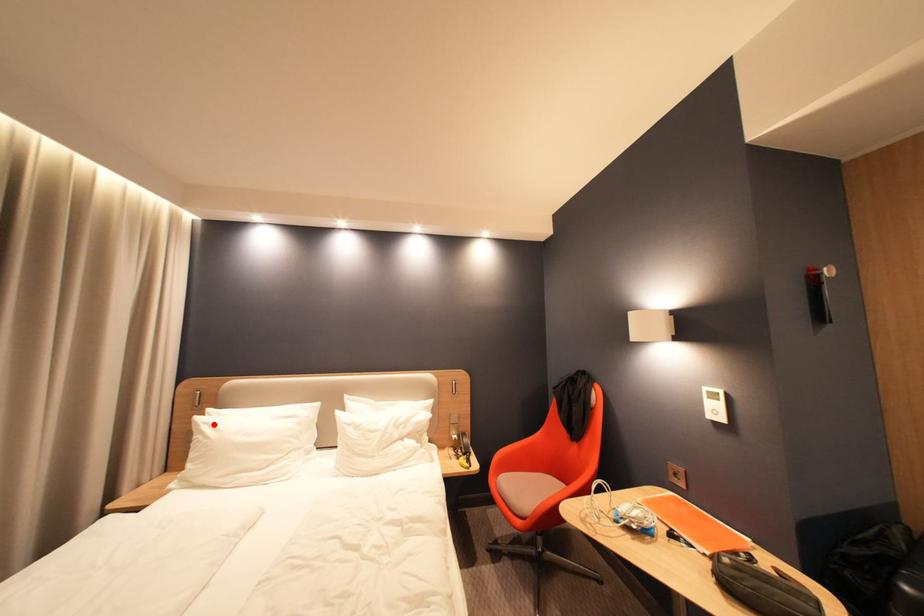
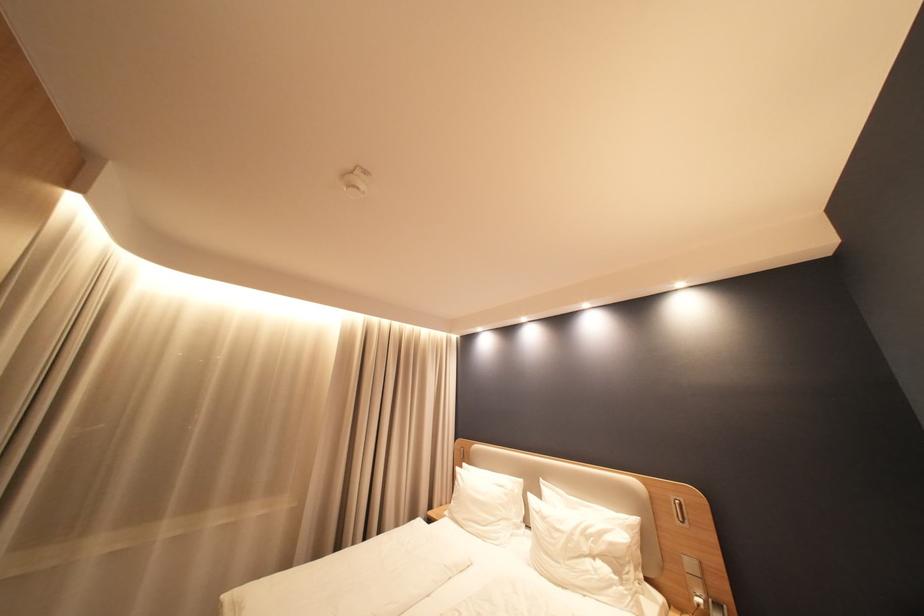
Question: I am providing you with two images of the same scene from different viewpoints. In image1, a red point is highlighted. Considering the same 3D point in image2, which of the following is correct?

Choices:
 (A) It is closer
 (B) It is farther

Answer: (B)